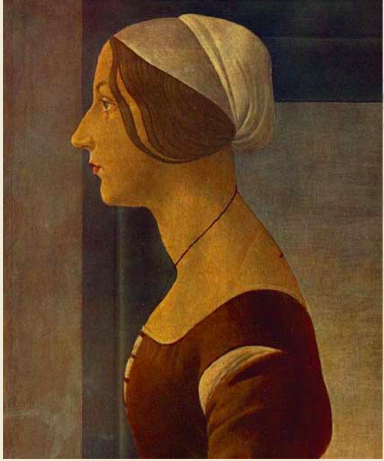
You are a GUI agent. You are given a task and a screenshot of the screen. Output one action in this format:
    pyautogui.click(x=<x>, y=<y>)
    Task: Click on the grey wall
    
    Given the screenshot: What is the action you would take?
    pyautogui.click(x=335, y=213)